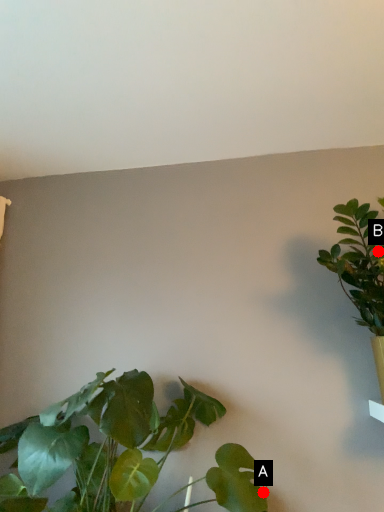
Question: Two points are circled on the image, labeled by A and B beside each circle. Which point is closer to the camera?

Choices:
 (A) A is closer
 (B) B is closer

Answer: (A)